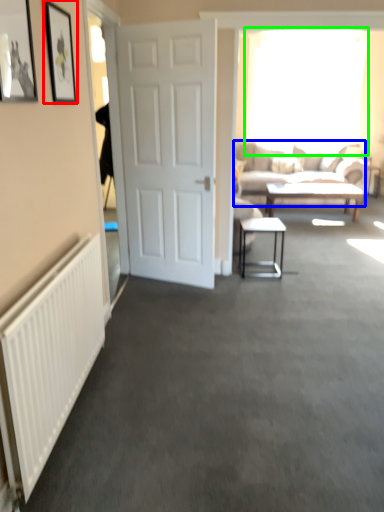
Question: Which object is positioned farthest from picture frame (highlighted by a red box)? Select from studio couch (highlighted by a blue box) and window (highlighted by a green box).

Choices:
 (A) studio couch
 (B) window

Answer: (B)